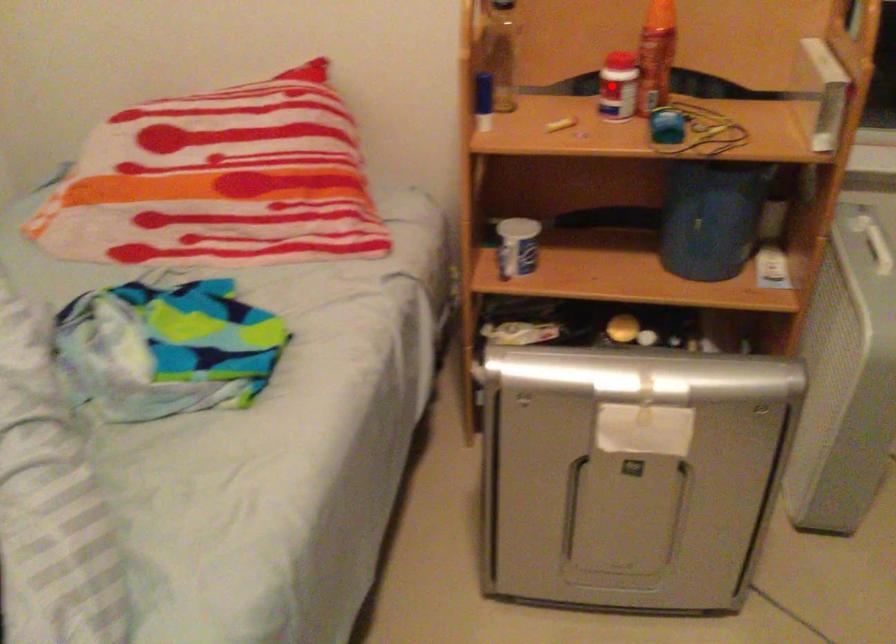
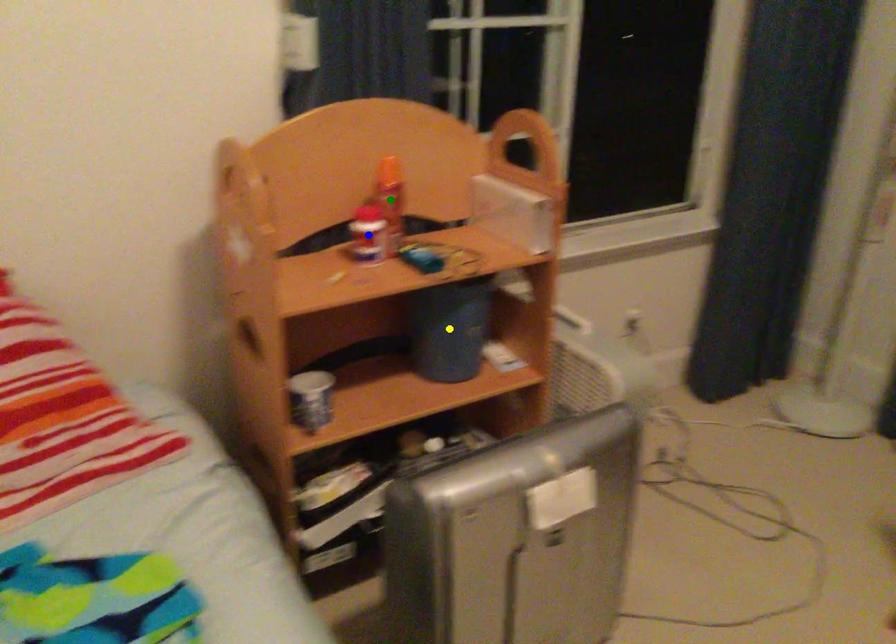
Question: I am providing you with two images of the same scene from different viewpoints. A red point is marked on the first image. You are given multiple points on the second image. Which point in image 2 represents the same 3d spot as the red point in image 1?

Choices:
 (A) green point
 (B) yellow point
 (C) blue point

Answer: (C)